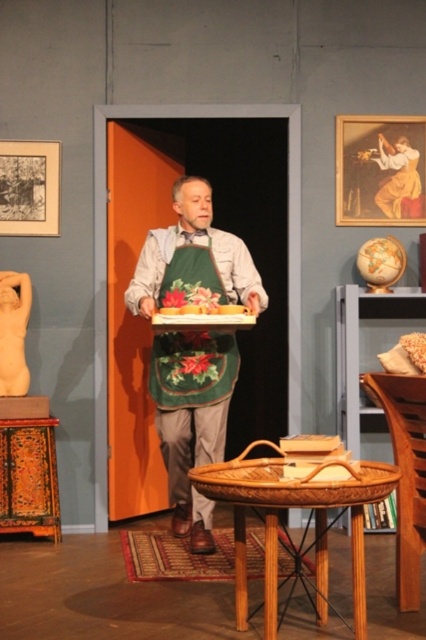
Question: In this image, where is woven wood table at center located relative to wooden wicker basket at lower left?

Choices:
 (A) below
 (B) above

Answer: (A)

Question: From the image, what is the correct spatial relationship of green felt apron at center in relation to woven wood table at center?

Choices:
 (A) below
 (B) above

Answer: (B)

Question: Which of the following is the closest to the observer?

Choices:
 (A) green felt apron at center
 (B) woven wood table at center
 (C) matte beige sculpture at left
 (D) woven wood chair at lower right

Answer: (B)

Question: Observing the image, what is the correct spatial positioning of green felt apron at center in reference to woven wood table at center?

Choices:
 (A) right
 (B) left

Answer: (B)

Question: Estimate the real-world distances between objects in this image. Which object is closer to the wooden wicker basket at lower left?

Choices:
 (A) woven wood chair at lower right
 (B) matte beige sculpture at left

Answer: (B)

Question: Which point is closer to the camera?

Choices:
 (A) matte beige sculpture at left
 (B) green felt apron at center
 (C) woven wood table at center
 (D) woven wood chair at lower right

Answer: (C)